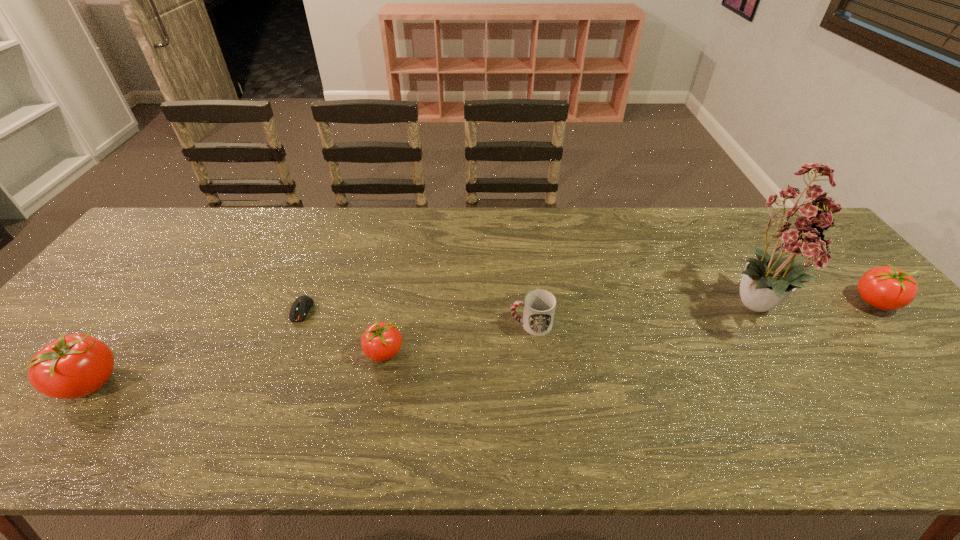
Image resolution: width=960 pixels, height=540 pixels. I want to click on the tallest tomato, so click(73, 366).

Where is `the leftmost object`? The image size is (960, 540). the leftmost object is located at coordinates (73, 366).

Locate an element on the screen. the shortest tomato is located at coordinates (381, 341).

Identify the location of the third object from left to right. This screenshot has width=960, height=540. (381, 341).

Identify the location of the rightmost object. The width and height of the screenshot is (960, 540). (887, 288).

Identify the location of the rightmost tomato. Image resolution: width=960 pixels, height=540 pixels. (887, 288).

Find the location of a particular element. the third object from right to left is located at coordinates (539, 305).

Where is `the second object from left to right`? This screenshot has height=540, width=960. the second object from left to right is located at coordinates (301, 305).

The image size is (960, 540). In order to click on computer equipment in this screenshot , I will do `click(301, 305)`.

At what (x,y) coordinates should I click in order to perform the action: click on the second object from right to left. Please return your answer as a coordinate pair (x, y). Image resolution: width=960 pixels, height=540 pixels. Looking at the image, I should click on (800, 229).